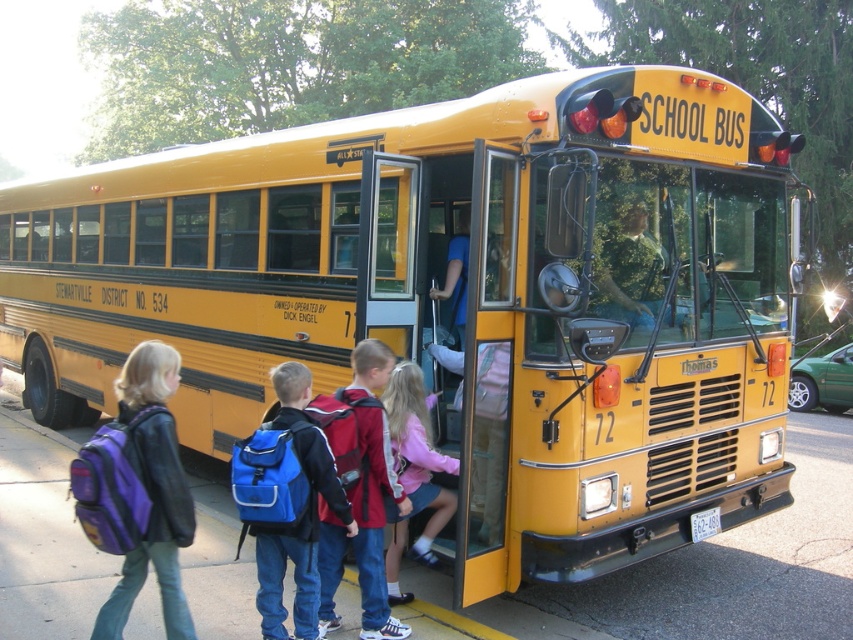
Which is behind, point (277, 381) or point (395, 632)?

Positioned behind is point (395, 632).

Does blue fabric backpack at center appear over red backpack at center?

Actually, blue fabric backpack at center is below red backpack at center.

Where is `blue fabric backpack at center`? blue fabric backpack at center is located at coordinates (287, 502).

Can you confirm if red backpack at center is shorter than matte pink sweater at center?

Incorrect, red backpack at center's height does not fall short of matte pink sweater at center's.

Can you confirm if red backpack at center is positioned to the left of matte pink sweater at center?

Correct, you'll find red backpack at center to the left of matte pink sweater at center.

Measure the distance between red backpack at center and camera.

The distance of red backpack at center from camera is 3.94 meters.

The height and width of the screenshot is (640, 853). Find the location of `red backpack at center`. red backpack at center is located at coordinates (360, 492).

Is blue fabric backpack at center thinner than matte pink sweater at center?

In fact, blue fabric backpack at center might be wider than matte pink sweater at center.

Between blue fabric backpack at center and matte pink sweater at center, which one is positioned higher?

blue fabric backpack at center

Is point (329, 474) positioned after point (424, 417)?

No, it is not.

The image size is (853, 640). What are the coordinates of `blue fabric backpack at center` in the screenshot? It's located at (287, 502).